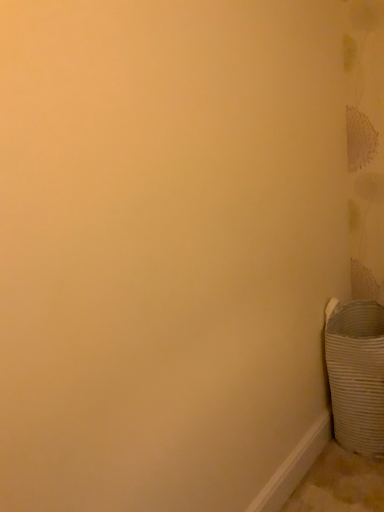
Image resolution: width=384 pixels, height=512 pixels. What do you see at coordinates (356, 374) in the screenshot? I see `white striped fabric at right` at bounding box center [356, 374].

Where is `white striped fabric at right`? This screenshot has height=512, width=384. white striped fabric at right is located at coordinates (356, 374).

The height and width of the screenshot is (512, 384). I want to click on white striped fabric at right, so click(x=356, y=374).